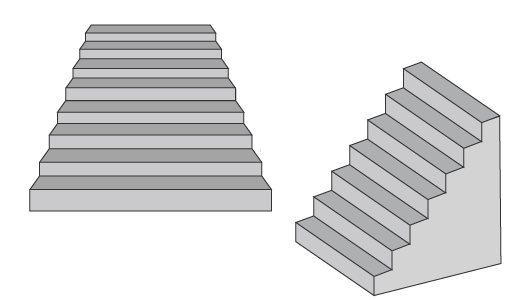
This screenshot has width=520, height=300. Find the location of `step on left staircase`. step on left staircase is located at coordinates (157, 184), (154, 158), (153, 131), (153, 107), (150, 82), (151, 63), (150, 47), (151, 29).